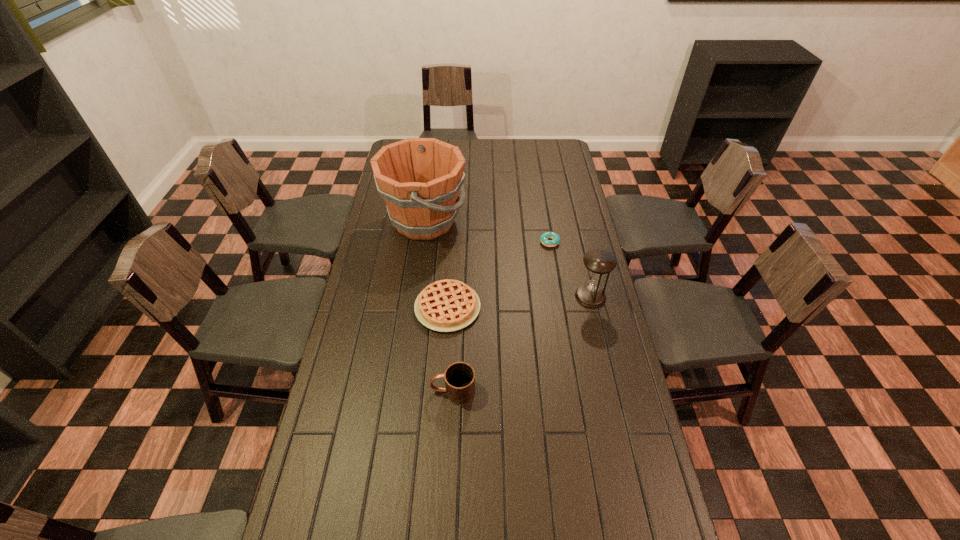
The image size is (960, 540). I want to click on blank space at the far right corner of the desktop, so click(566, 154).

This screenshot has height=540, width=960. Identify the location of free space between the doughnut and the mug. (501, 316).

Identify the location of unoccupied area between the hourglass and the mug. The height and width of the screenshot is (540, 960). (521, 343).

Find the location of a particular element. The height and width of the screenshot is (540, 960). unoccupied area between the bucket and the rightmost object is located at coordinates (508, 259).

In order to click on vacant space that is in between the tallest object and the pie in this screenshot , I will do `click(436, 264)`.

This screenshot has width=960, height=540. I want to click on empty location between the mug and the pie, so click(x=450, y=349).

At what (x,y) coordinates should I click in order to perform the action: click on vacant point located between the mug and the shortest object. Please return your answer as a coordinate pair (x, y). Looking at the image, I should click on (501, 316).

The height and width of the screenshot is (540, 960). Identify the location of free space between the pie and the nearest object. (450, 349).

Where is `free space between the nearest object and the second shortest object`? The height and width of the screenshot is (540, 960). free space between the nearest object and the second shortest object is located at coordinates (450, 349).

Identify the location of vacant space that's between the mug and the rightmost object. (521, 343).